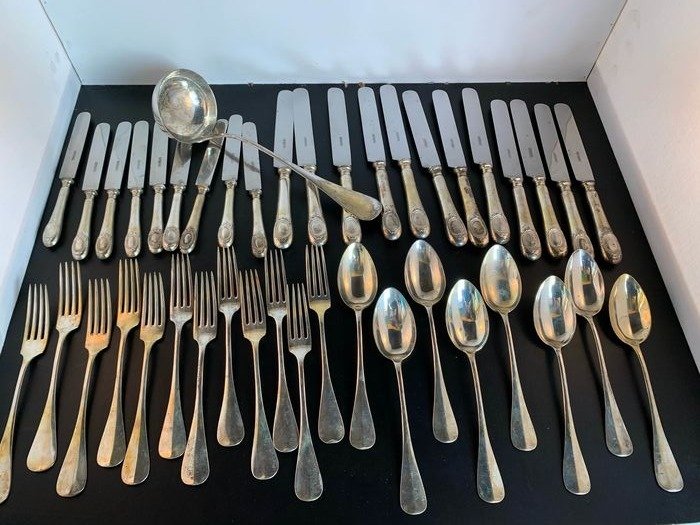
The width and height of the screenshot is (700, 525). Find the location of `spoons`. spoons is located at coordinates (360, 285), (399, 330), (430, 272), (469, 321), (558, 333), (589, 281), (635, 315), (496, 278).